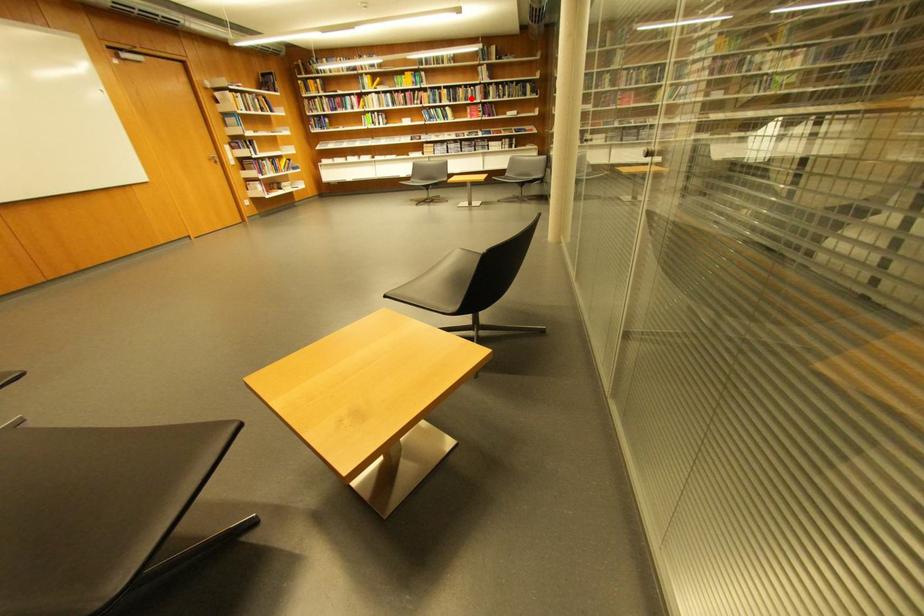
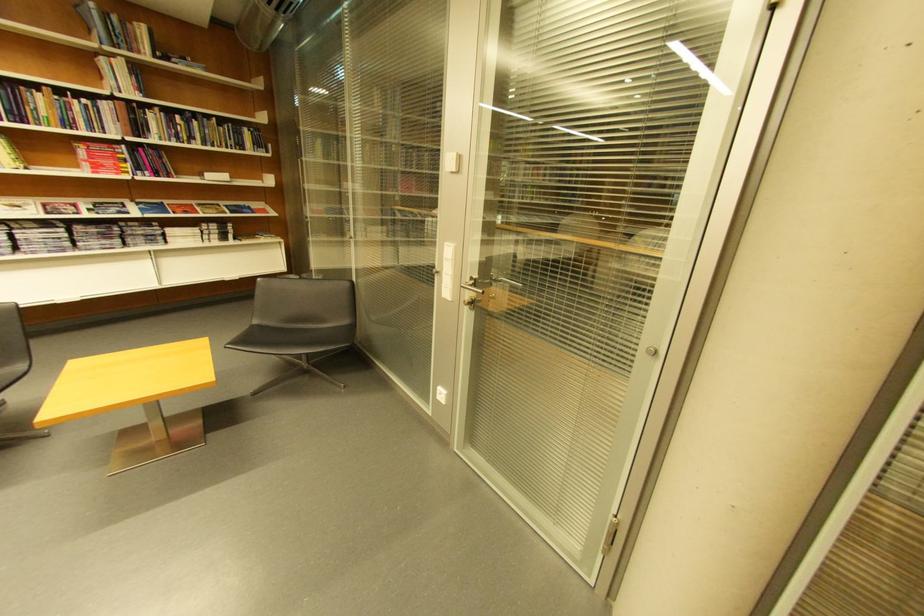
Where in the second image is the point corresponding to the highlighted location from the first image?

(54, 116)